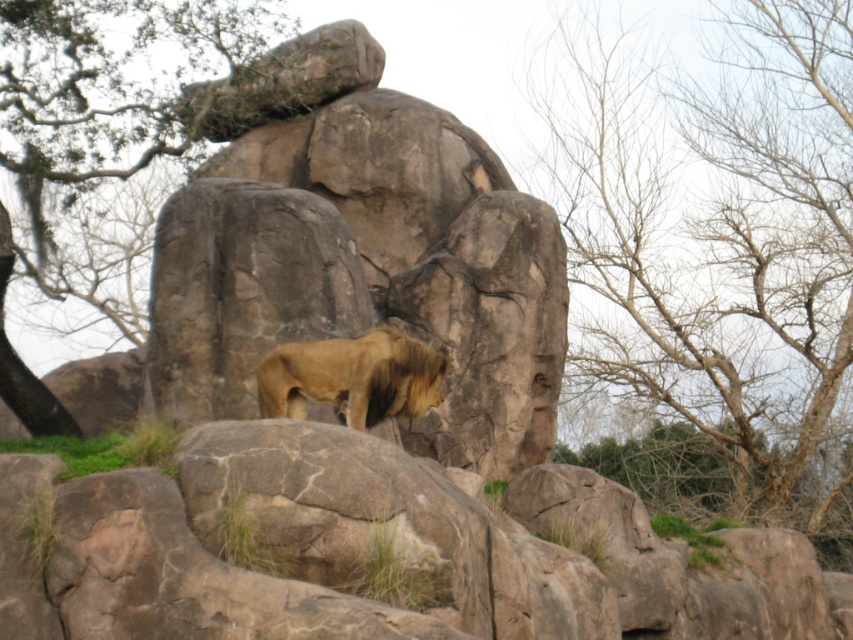
Can you confirm if bare branches at upper right is positioned below green leafy tree at upper left?

Yes, bare branches at upper right is below green leafy tree at upper left.

Does bare branches at upper right appear over green leafy tree at upper left?

Incorrect, bare branches at upper right is not positioned above green leafy tree at upper left.

You are a GUI agent. You are given a task and a screenshot of the screen. Output one action in this format:
    pyautogui.click(x=<x>, y=<y>)
    Task: Click on the bare branches at upper right
    The height and width of the screenshot is (640, 853).
    Given the screenshot: What is the action you would take?
    pos(717,228)

In the scene shown: Between green leafy tree at upper left and golden fur lion at center, which one appears on the left side from the viewer's perspective?

green leafy tree at upper left

Between green leafy tree at upper left and golden fur lion at center, which one is positioned lower?

golden fur lion at center is lower down.

Is point (163, 60) farther from viewer compared to point (380, 360)?

Yes, it is behind point (380, 360).

I want to click on green leafy tree at upper left, so click(107, 100).

Is point (672, 240) farther from viewer compared to point (300, 394)?

Yes, point (672, 240) is farther from viewer.

What do you see at coordinates (717, 228) in the screenshot?
I see `bare branches at upper right` at bounding box center [717, 228].

You are a GUI agent. You are given a task and a screenshot of the screen. Output one action in this format:
    pyautogui.click(x=<x>, y=<y>)
    Task: Click on the bare branches at upper right
    
    Given the screenshot: What is the action you would take?
    pyautogui.click(x=717, y=228)